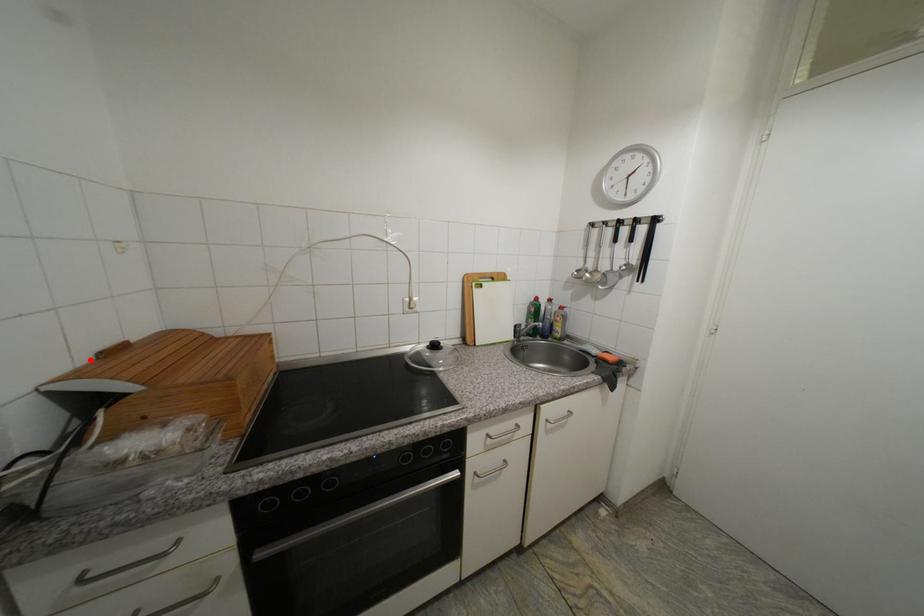
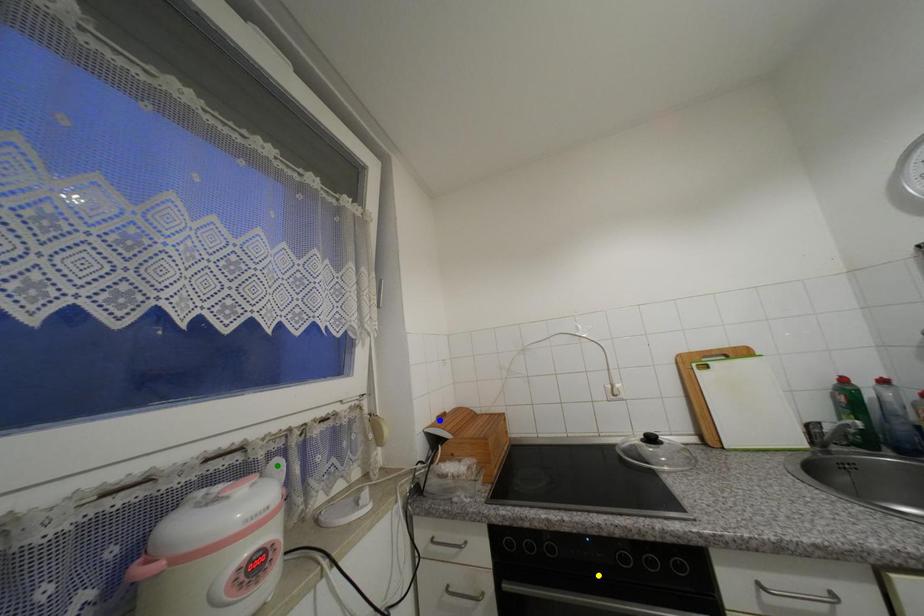
Question: I am providing you with two images of the same scene from different viewpoints. A red point is marked on the first image. You are given multiple points on the second image. Which spot in image 2 lines up with the point in image 1?

Choices:
 (A) blue point
 (B) green point
 (C) yellow point

Answer: (A)